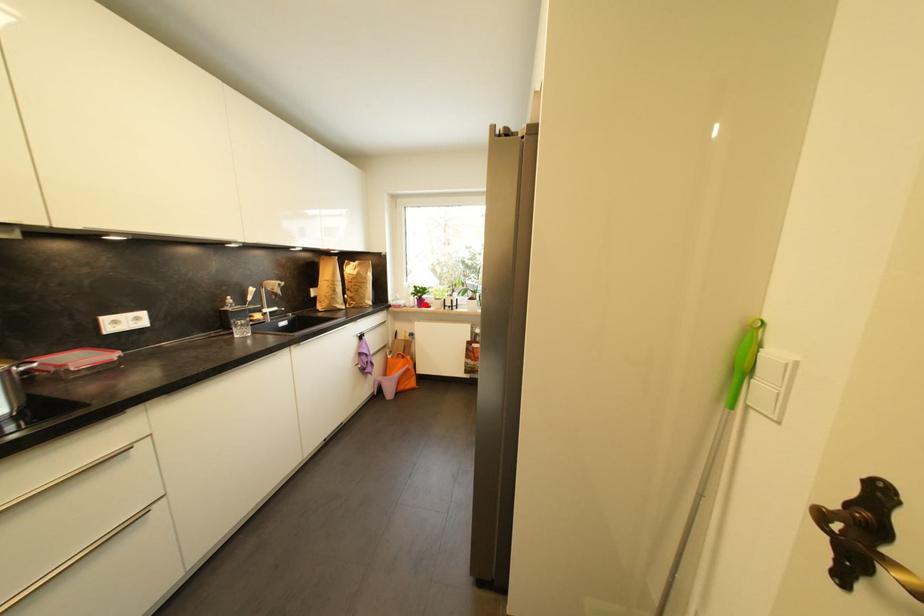
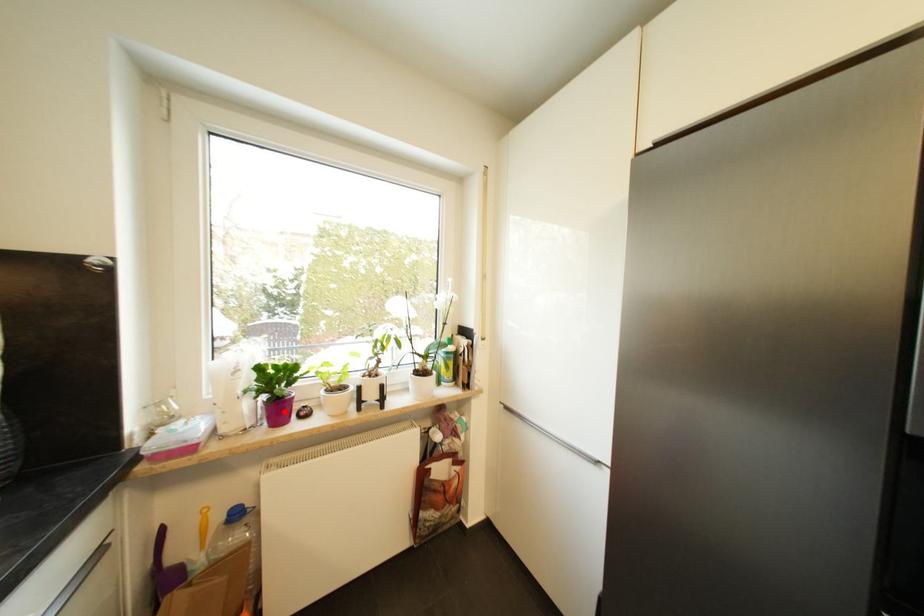
I am providing you with two images of the same scene from different viewpoints. A red point is marked on the first image and another point is marked on the second image. Is the red point in image1 aligned with the point shown in image2?

Yes